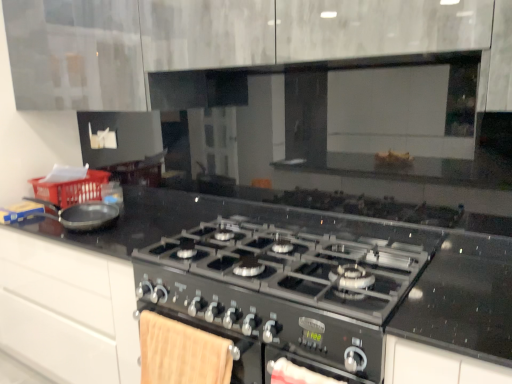
Question: Would you say red plastic basket at left is inside or outside black metallic gas stove at center?

Choices:
 (A) inside
 (B) outside

Answer: (B)

Question: Visually, is red plastic basket at left positioned to the left or to the right of black metallic gas stove at center?

Choices:
 (A) left
 (B) right

Answer: (A)

Question: Estimate the real-world distances between objects in this image. Which object is closer to the matte black frying pan at left?

Choices:
 (A) black metallic gas stove at center
 (B) red plastic basket at left

Answer: (B)

Question: Estimate the real-world distances between objects in this image. Which object is farther from the matte black frying pan at left?

Choices:
 (A) black metallic gas stove at center
 (B) red plastic basket at left

Answer: (A)